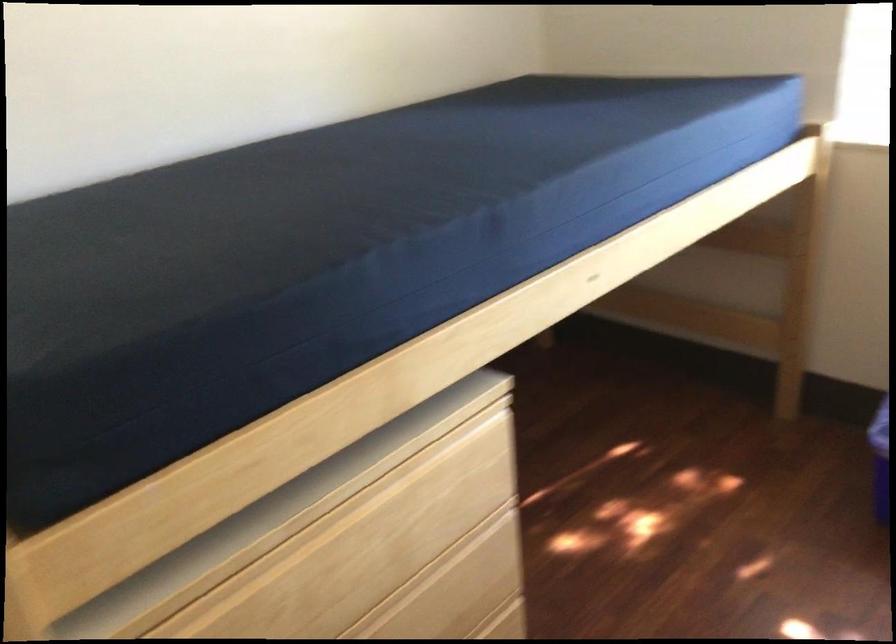
What do you see at coordinates (803, 275) in the screenshot? The image size is (896, 644). I see `the bed ladder rung` at bounding box center [803, 275].